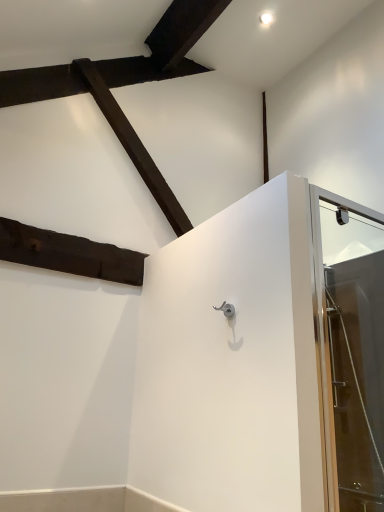
The width and height of the screenshot is (384, 512). Describe the element at coordinates (351, 348) in the screenshot. I see `clear glass shower door at right` at that location.

The width and height of the screenshot is (384, 512). In order to click on clear glass shower door at right in this screenshot , I will do `click(351, 348)`.

In order to click on clear glass shower door at right in this screenshot , I will do `click(351, 348)`.